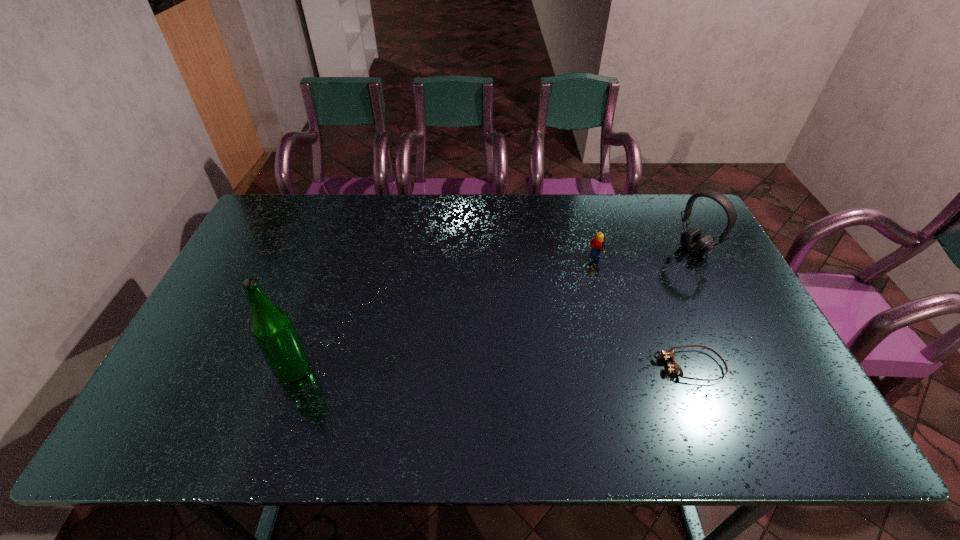
The height and width of the screenshot is (540, 960). In order to click on the leftmost object in this screenshot , I will do `click(272, 329)`.

Find the location of a particular element. The height and width of the screenshot is (540, 960). the tallest object is located at coordinates (272, 329).

Locate an element on the screen. the shortest object is located at coordinates (673, 367).

At what (x,y) coordinates should I click in order to perform the action: click on goggles. Please return your answer as a coordinate pair (x, y). The height and width of the screenshot is (540, 960). Looking at the image, I should click on (673, 367).

At what (x,y) coordinates should I click in order to perform the action: click on the rightmost object. Please return your answer as a coordinate pair (x, y). This screenshot has height=540, width=960. Looking at the image, I should click on (691, 240).

Where is `the third shortest object`? The width and height of the screenshot is (960, 540). the third shortest object is located at coordinates (691, 240).

In order to click on Lego in this screenshot , I will do `click(597, 245)`.

Locate an element on the screen. the second shortest object is located at coordinates (597, 245).

Image resolution: width=960 pixels, height=540 pixels. I want to click on vacant space located 0.200m on the label of the beer bottle, so click(x=195, y=370).

I want to click on free location located 0.110m on the label of the beer bottle, so click(231, 370).